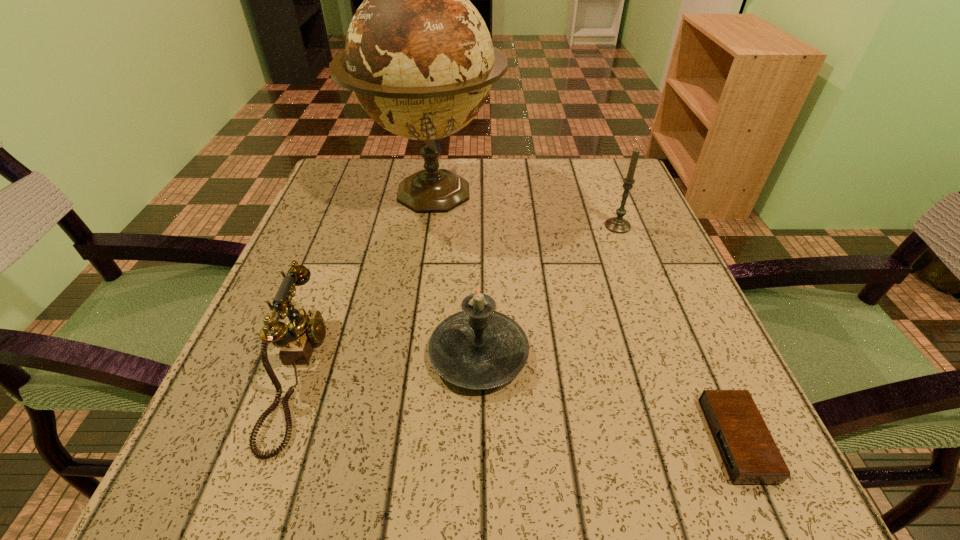
In order to click on empty space that is in between the shortest object and the shorter candle in this screenshot , I will do `click(608, 397)`.

Locate an element on the screen. free area in between the farther candle and the alarm clock is located at coordinates (677, 333).

You are a GUI agent. You are given a task and a screenshot of the screen. Output one action in this format:
    pyautogui.click(x=<x>, y=<y>)
    Task: Click on the closest object to the right candle
    
    Given the screenshot: What is the action you would take?
    pyautogui.click(x=419, y=58)

At what (x,y) coordinates should I click in order to perform the action: click on object that is the third closest to the nearer candle. Please return your answer as a coordinate pair (x, y). The height and width of the screenshot is (540, 960). Looking at the image, I should click on (750, 455).

Find the location of a particular element. The height and width of the screenshot is (540, 960). free space that satisfies the following two spatial constraints: 1. on the front of the globe showing Asia; 2. on the right side of the farther candle is located at coordinates (426, 226).

Find the location of a particular element. This screenshot has height=540, width=960. free spot that satisfies the following two spatial constraints: 1. on the front of the tallest object showing Asia; 2. on the front-facing side of the telephone is located at coordinates click(x=404, y=373).

Identify the location of vacant point that satisfies the following two spatial constraints: 1. on the front side of the shorter candle; 2. on the front-facing side of the second shortest object. (479, 373).

Identify the location of vacant point that satisfies the following two spatial constraints: 1. on the front side of the right candle; 2. on the front-facing side of the second shortest object. (674, 373).

What are the coordinates of `free location that satisfies the following two spatial constraints: 1. on the front of the globe showing Asia; 2. on the front-facing side of the fourth tallest object` in the screenshot? It's located at (404, 373).

The width and height of the screenshot is (960, 540). Identify the location of free space that satisfies the following two spatial constraints: 1. on the front of the left candle showing Asia; 2. on the right side of the globe. (407, 354).